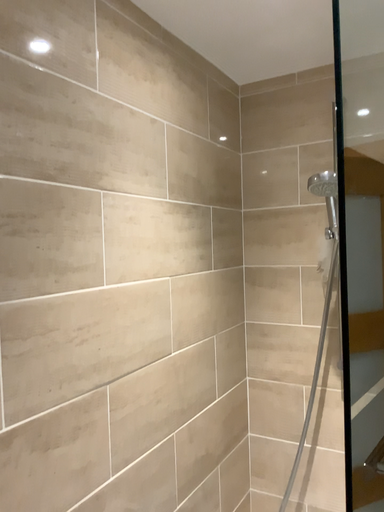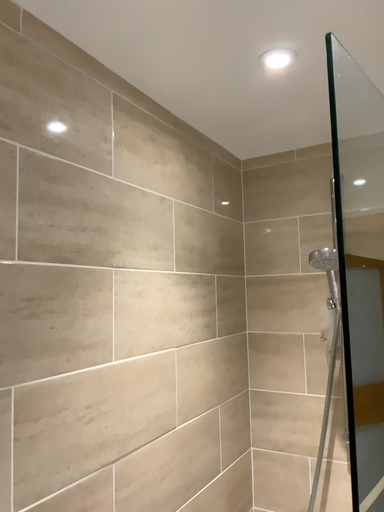
Question: How did the camera likely rotate when shooting the video?

Choices:
 (A) rotated upward
 (B) rotated downward

Answer: (A)